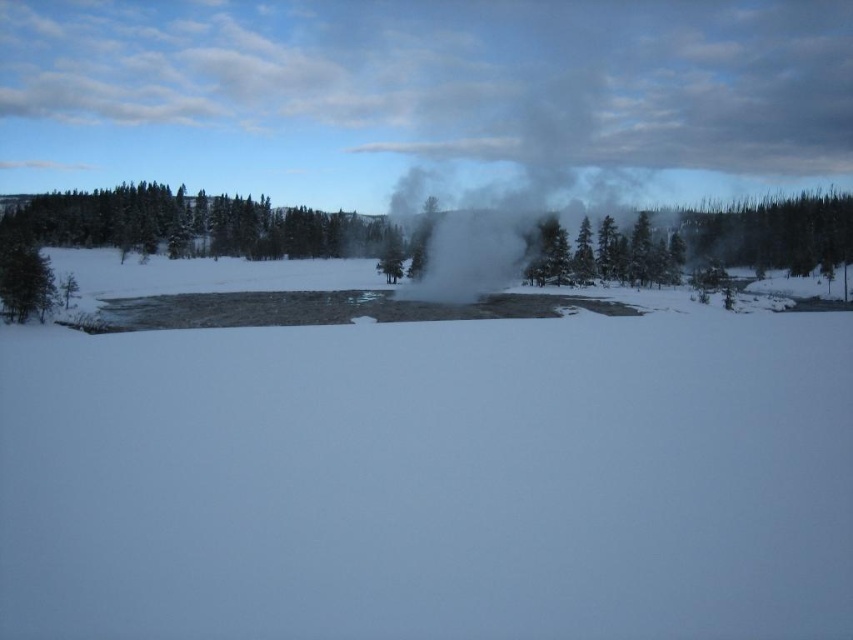
You are an environmental scientist studying the winter landscape. You observe the green matte tree at upper center and the white vapor steam at center. Which object appears taller in the scene?

The white vapor steam at center appears taller than the green matte tree at upper center.

You are an observer looking at the winter landscape. You notice the green matte tree at upper center and the white vapor steam at center. Which object is positioned to the left of the other?

The green matte tree at upper center is to the left of white vapor steam at center.